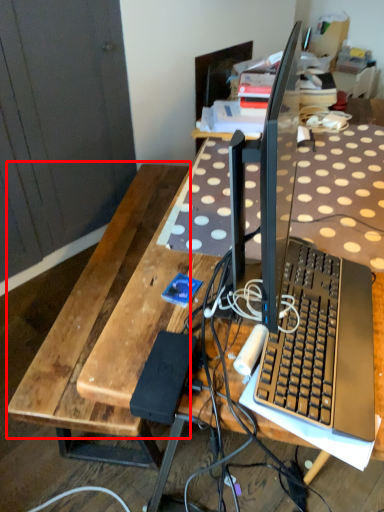
Question: Considering the relative positions of wood (annotated by the red box) and computer keyboard in the image provided, where is wood (annotated by the red box) located with respect to the staircase?

Choices:
 (A) right
 (B) left

Answer: (B)